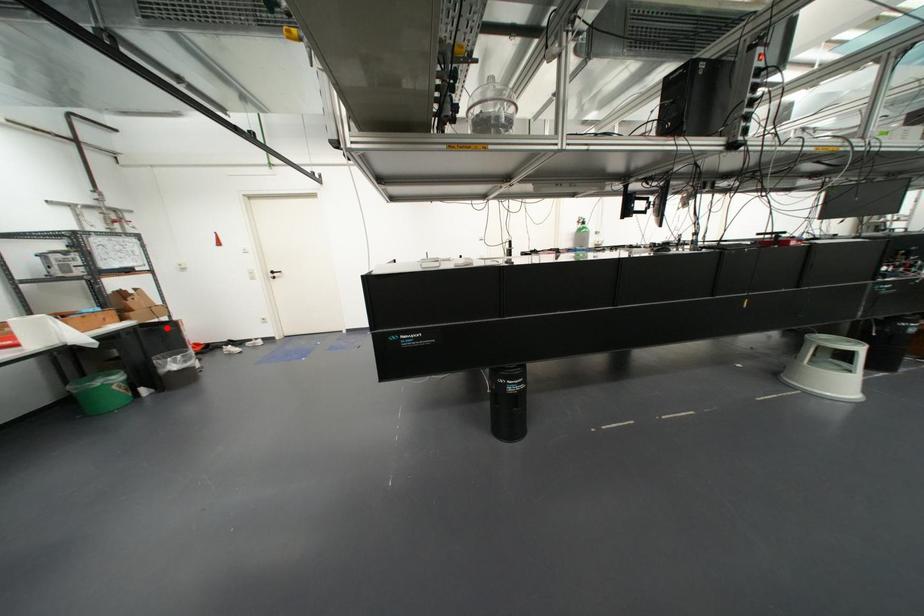
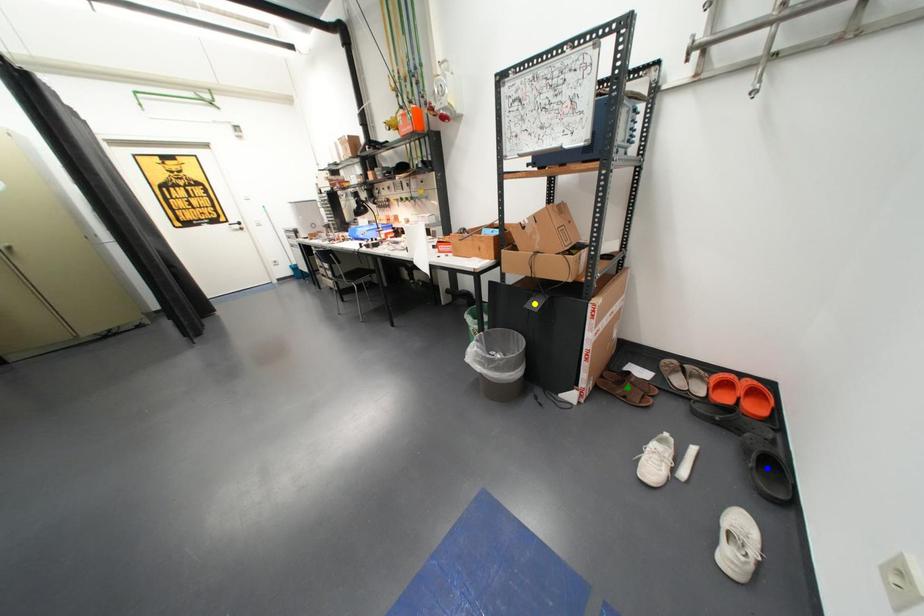
Question: I am providing you with two images of the same scene from different viewpoints. A red point is marked on the first image. You are given multiple points on the second image. Which point in image 2 represents the same 3d spot as the red point in image 1?

Choices:
 (A) green point
 (B) blue point
 (C) yellow point

Answer: (C)